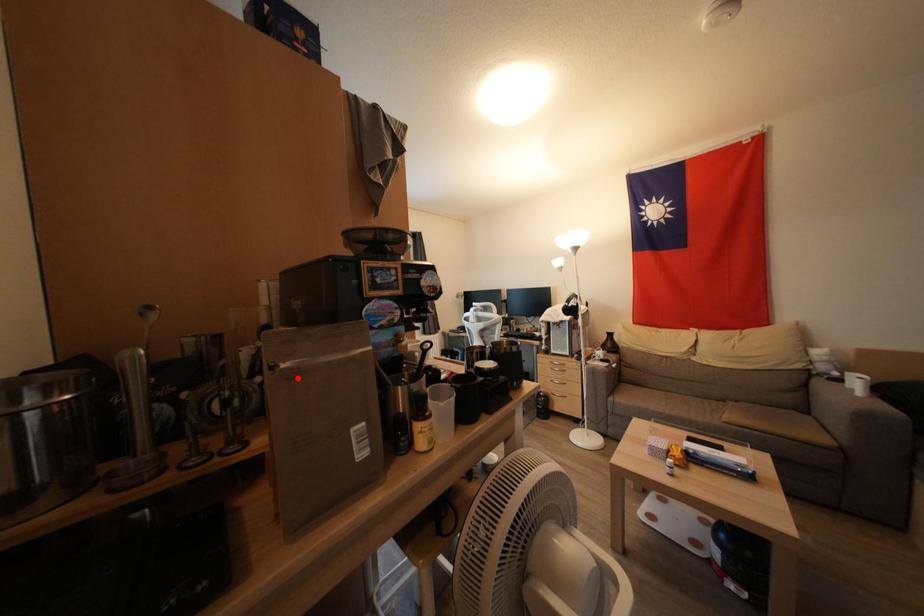
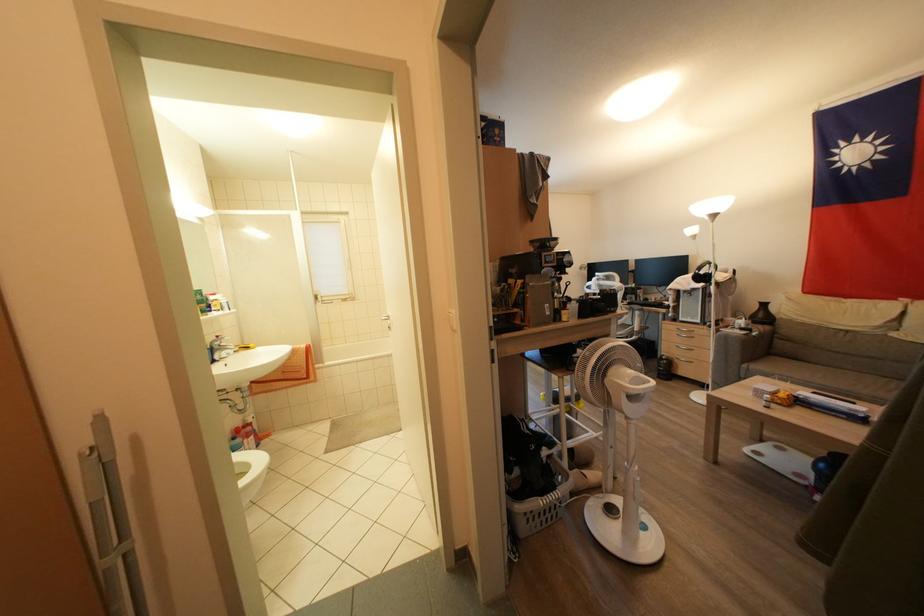
Where in the second image is the point corresponding to the highlighted location from the first image?

(537, 291)